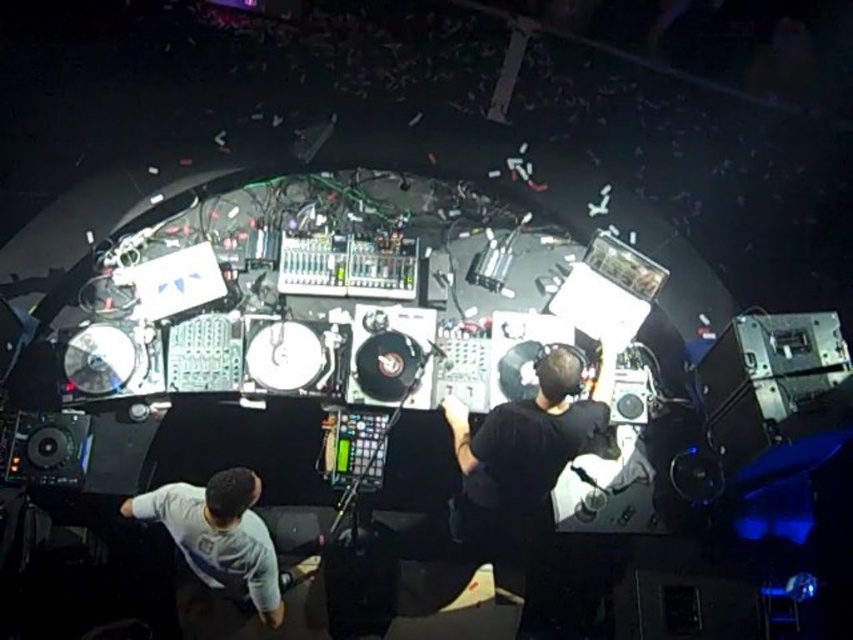
Question: Is black matte headphones at center above white matte shirt at lower left?

Choices:
 (A) yes
 (B) no

Answer: (A)

Question: Can you confirm if black matte headphones at center is positioned to the left of white matte shirt at lower left?

Choices:
 (A) no
 (B) yes

Answer: (A)

Question: Which point appears closest to the camera in this image?

Choices:
 (A) (496, 465)
 (B) (173, 502)

Answer: (A)

Question: Which of the following is the closest to the observer?

Choices:
 (A) [247, 584]
 (B) [546, 426]

Answer: (B)

Question: Does black matte headphones at center have a greater width compared to white matte shirt at lower left?

Choices:
 (A) yes
 (B) no

Answer: (A)